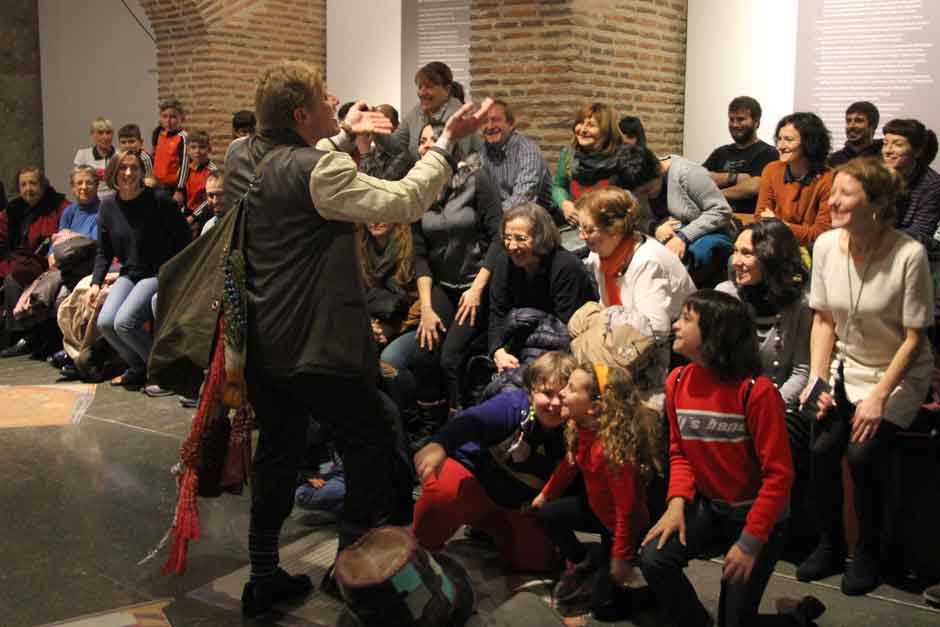
Find the location of `tassle`. tassle is located at coordinates point(190,520), point(180,555).